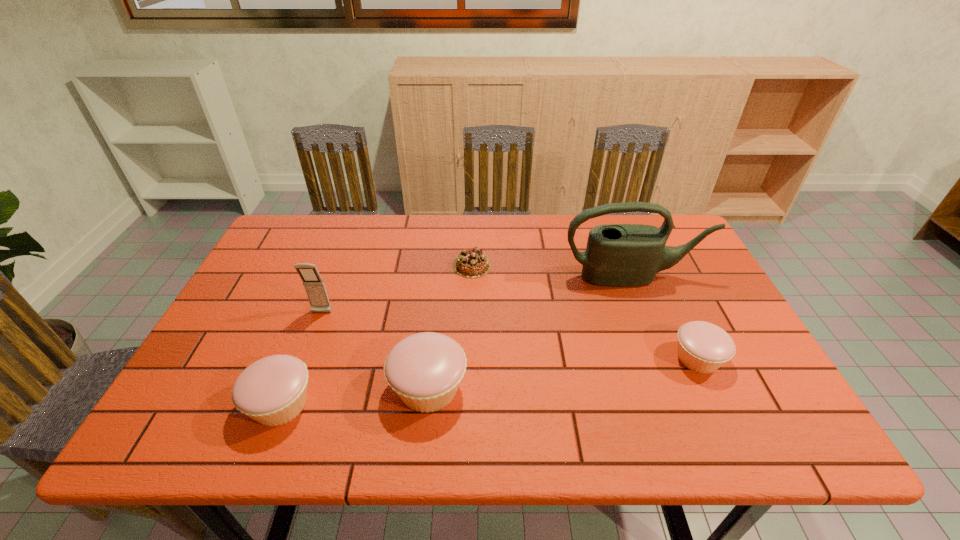
The width and height of the screenshot is (960, 540). What are the coordinates of `free spot between the tallest object and the shortest object` in the screenshot? It's located at (552, 271).

You are a GUI agent. You are given a task and a screenshot of the screen. Output one action in this format:
    pyautogui.click(x=<x>, y=<y>)
    Task: Click on the free space between the tallest object and the shortest cupcake
    
    Given the screenshot: What is the action you would take?
    pyautogui.click(x=665, y=318)

At what (x,y) coordinates should I click in order to perform the action: click on free space between the third farthest object and the second cupcake from right to left. Please return your answer as a coordinate pair (x, y). Looking at the image, I should click on (375, 350).

Find the location of a particular element. The height and width of the screenshot is (540, 960). free space between the watering can and the fourth nearest object is located at coordinates (477, 295).

What are the coordinates of `free space between the shortest object and the tallest object` in the screenshot? It's located at (552, 271).

I want to click on free spot between the second cupcake from right to left and the second tallest cupcake, so click(x=354, y=396).

Locate an element on the screen. The width and height of the screenshot is (960, 540). unoccupied area between the second cupcake from left to right and the fourth tallest object is located at coordinates (354, 396).

Identify the location of object that ranks as the fifth closest to the second cupcake from right to left. (703, 347).

Locate an element on the screen. The width and height of the screenshot is (960, 540). the second closest object to the cellular telephone is located at coordinates (425, 370).

Locate an element on the screen. cupcake that stands as the closest to the rightmost cupcake is located at coordinates (425, 370).